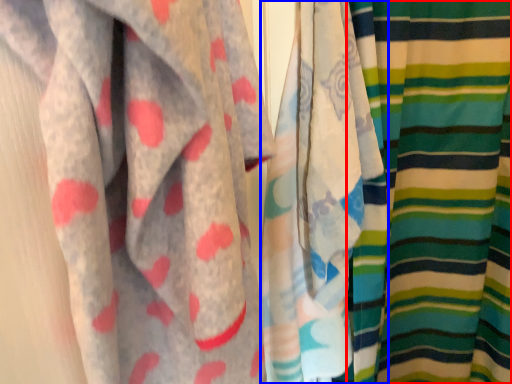
Question: Which object is closer to the camera taking this photo, curtain (highlighted by a red box) or curtain (highlighted by a blue box)?

Choices:
 (A) curtain
 (B) curtain

Answer: (B)